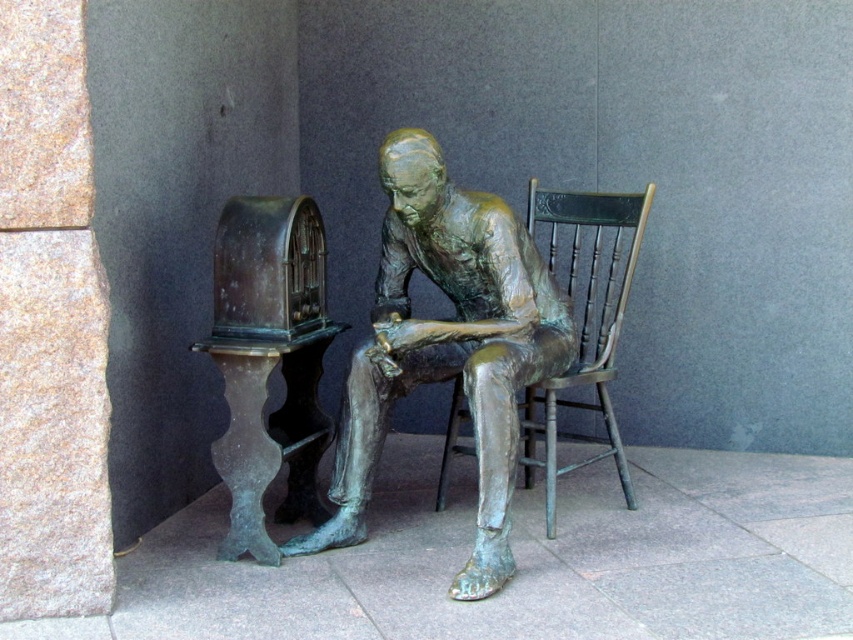
Question: Considering the relative positions of green patina statue at center and bronze wooden chair at center in the image provided, where is green patina statue at center located with respect to bronze wooden chair at center?

Choices:
 (A) below
 (B) above

Answer: (B)

Question: Among these objects, which one is farthest from the camera?

Choices:
 (A) bronze wooden chair at center
 (B) green patina statue at center

Answer: (A)

Question: Does green patina statue at center have a larger size compared to bronze wooden chair at center?

Choices:
 (A) no
 (B) yes

Answer: (A)

Question: Which object appears farthest from the camera in this image?

Choices:
 (A) green patina statue at center
 (B) bronze wooden chair at center

Answer: (B)

Question: Which object is farther from the camera taking this photo?

Choices:
 (A) bronze wooden chair at center
 (B) green patina statue at center

Answer: (A)

Question: Where is green patina statue at center located in relation to bronze wooden chair at center in the image?

Choices:
 (A) above
 (B) below

Answer: (A)